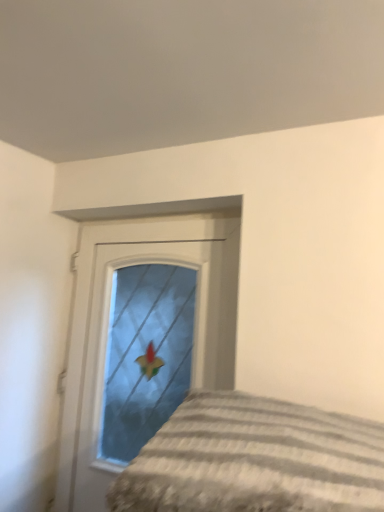
Question: Is striped fabric bed at lower right inside the boundaries of matte glass door at center, or outside?

Choices:
 (A) outside
 (B) inside

Answer: (A)

Question: In terms of size, does striped fabric bed at lower right appear bigger or smaller than matte glass door at center?

Choices:
 (A) big
 (B) small

Answer: (B)

Question: From the image's perspective, is striped fabric bed at lower right located above or below matte glass door at center?

Choices:
 (A) above
 (B) below

Answer: (A)

Question: From the image's perspective, is matte glass door at center located above or below striped fabric bed at lower right?

Choices:
 (A) above
 (B) below

Answer: (B)

Question: Is matte glass door at center in front of or behind striped fabric bed at lower right in the image?

Choices:
 (A) front
 (B) behind

Answer: (B)

Question: In terms of height, does matte glass door at center look taller or shorter compared to striped fabric bed at lower right?

Choices:
 (A) tall
 (B) short

Answer: (A)

Question: Based on their sizes in the image, would you say matte glass door at center is bigger or smaller than striped fabric bed at lower right?

Choices:
 (A) small
 (B) big

Answer: (B)